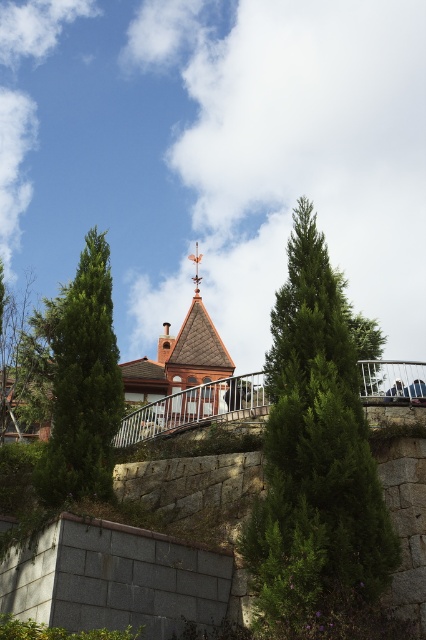
Question: Where is green textured tree at left located in relation to dark blue jeans at center in the image?

Choices:
 (A) below
 (B) above

Answer: (B)

Question: Can you confirm if green leafy tree at upper center is positioned below metallic silver person at center?

Choices:
 (A) yes
 (B) no

Answer: (B)

Question: Among these objects, which one is farthest from the camera?

Choices:
 (A) metallic silver person at center
 (B) green leafy tree at center

Answer: (A)

Question: Based on their relative distances, which object is farther from the green leafy tree at center?

Choices:
 (A) dark blue jeans at center
 (B) metallic silver person at center

Answer: (B)

Question: Considering the real-world distances, which object is closest to the metallic silver person at center?

Choices:
 (A) green textured tree at left
 (B) green leafy tree at center
 (C) dark blue jeans at center

Answer: (C)

Question: Is green leafy tree at upper center to the left of dark blue jeans at center from the viewer's perspective?

Choices:
 (A) no
 (B) yes

Answer: (A)